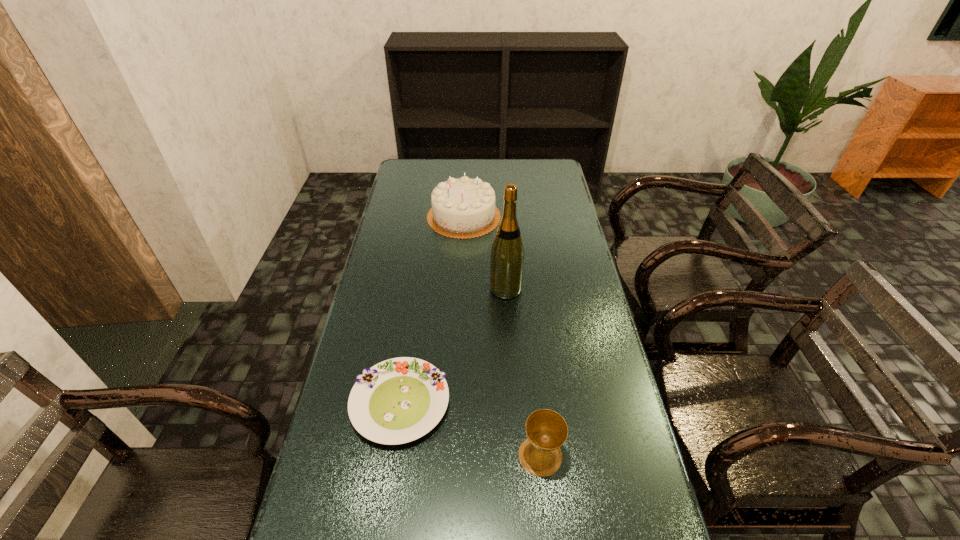
Where is `the second farthest object`? the second farthest object is located at coordinates (507, 253).

Where is `wine bottle`? This screenshot has width=960, height=540. wine bottle is located at coordinates (507, 253).

I want to click on the farthest object, so click(464, 208).

Locate an element on the screen. the second tallest object is located at coordinates (464, 208).

I want to click on the second shortest object, so click(546, 430).

This screenshot has width=960, height=540. I want to click on the shortest object, so click(399, 400).

Image resolution: width=960 pixels, height=540 pixels. In order to click on vacant space located on the front-facing side of the wine bottle in this screenshot , I will do `click(395, 288)`.

I want to click on vacant area situated on the front-facing side of the wine bottle, so click(x=466, y=288).

Locate an element on the screen. free spot located on the front-facing side of the wine bottle is located at coordinates (472, 288).

Where is `free space located 0.250m on the back of the farthest object`? free space located 0.250m on the back of the farthest object is located at coordinates (467, 168).